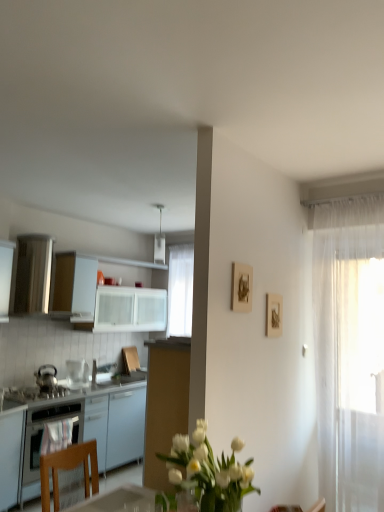
Question: Is shiny metallic kettle at left, acting as the 1th kitchen appliance starting from the left, thinner than white glossy cabinets at left, arranged as the 2th cabinetry when viewed from the top?

Choices:
 (A) no
 (B) yes

Answer: (B)

Question: From the image's perspective, is shiny metallic kettle at left, acting as the second kitchen appliance starting from the right, on top of white glossy cabinets at left, arranged as the 2th cabinetry when viewed from the top?

Choices:
 (A) no
 (B) yes

Answer: (B)

Question: Does shiny metallic kettle at left, acting as the second kitchen appliance starting from the right, have a larger size compared to white glossy cabinets at left, arranged as the 2th cabinetry when viewed from the top?

Choices:
 (A) yes
 (B) no

Answer: (B)

Question: Is shiny metallic kettle at left, acting as the second kitchen appliance starting from the right, far away from white glossy cabinets at left, arranged as the 2th cabinetry when viewed from the top?

Choices:
 (A) yes
 (B) no

Answer: (B)

Question: Can we say shiny metallic kettle at left, acting as the 1th kitchen appliance starting from the left, lies outside white glossy cabinets at left, positioned as the 1th cabinetry in bottom-to-top order?

Choices:
 (A) yes
 (B) no

Answer: (A)

Question: Is shiny metallic kettle at left, acting as the second kitchen appliance starting from the right, taller than white glossy cabinets at left, arranged as the 2th cabinetry when viewed from the top?

Choices:
 (A) yes
 (B) no

Answer: (B)

Question: Is satin black stove at lower left taller than white plastic light fixture at upper center?

Choices:
 (A) yes
 (B) no

Answer: (B)

Question: Is satin black stove at lower left facing away from white plastic light fixture at upper center?

Choices:
 (A) no
 (B) yes

Answer: (A)

Question: Can you confirm if satin black stove at lower left is thinner than white plastic light fixture at upper center?

Choices:
 (A) no
 (B) yes

Answer: (A)

Question: Is white plastic light fixture at upper center surrounded by satin black stove at lower left?

Choices:
 (A) yes
 (B) no

Answer: (B)

Question: Is satin black stove at lower left at the right side of white plastic light fixture at upper center?

Choices:
 (A) no
 (B) yes

Answer: (A)

Question: Is the depth of satin black stove at lower left greater than that of white plastic light fixture at upper center?

Choices:
 (A) yes
 (B) no

Answer: (B)

Question: Is shiny metallic kettle at left, acting as the 1th kitchen appliance starting from the left, thinner than white glossy microwave at upper left, the first kitchen appliance from the right?

Choices:
 (A) yes
 (B) no

Answer: (A)